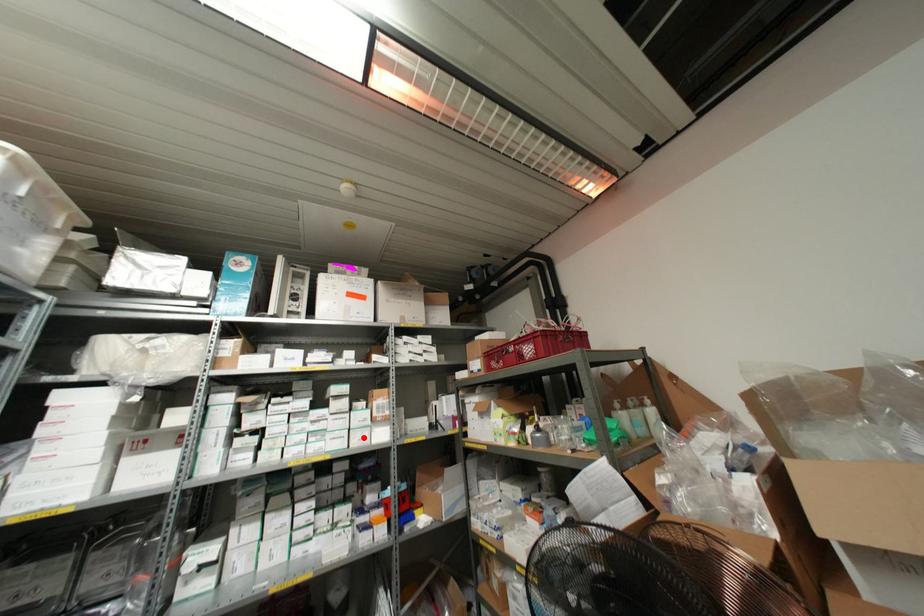
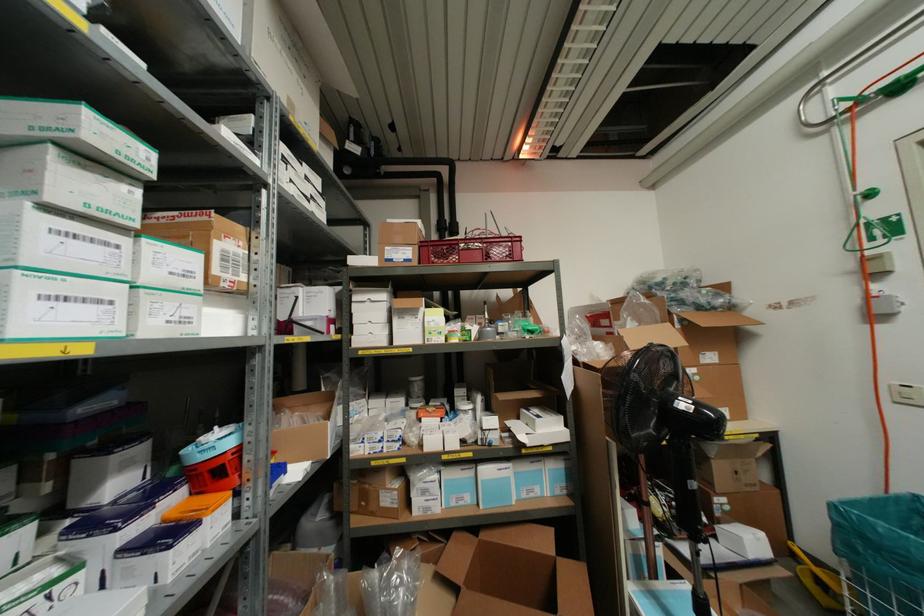
Locate, in the second image, the point that corresponds to the highlighted location in the first image.

(185, 320)